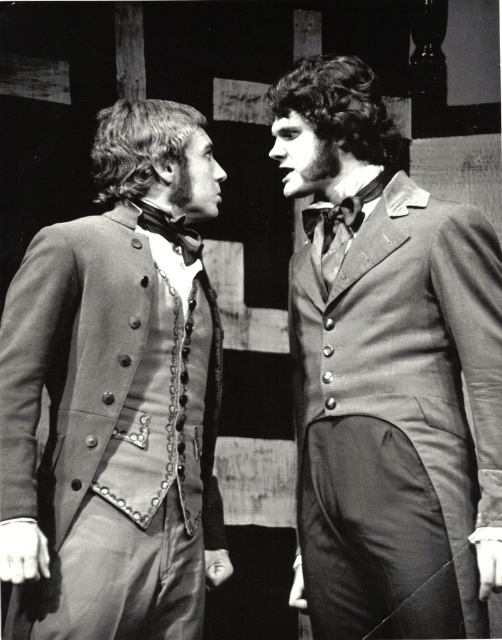
Based on the photo, which is above, smooth gray suit at center or smooth gray coat at left?

smooth gray suit at center

Can you confirm if smooth gray suit at center is wider than smooth gray coat at left?

Correct, the width of smooth gray suit at center exceeds that of smooth gray coat at left.

Is point (395, 454) closer to viewer compared to point (123, 577)?

No, it is behind (123, 577).

The width and height of the screenshot is (502, 640). What are the coordinates of `smooth gray suit at center` in the screenshot? It's located at pos(387,372).